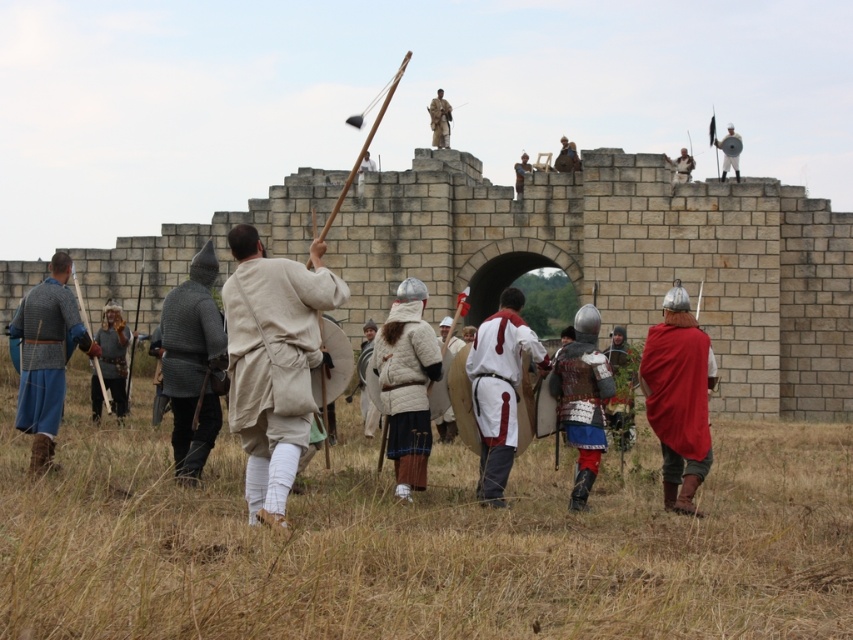
You are a historian analyzing a historical reenactment scene. You notice the metallic chainmail armor at left. Can you determine its exact coordinates in the image?

The metallic chainmail armor at left is located at coordinates point [45,356].

You are a medieval squire observing the historical reenactment. You need to determine which item is smaller between the red cloth cape at center and the metallic chainmail armor at left. Which one is smaller?

The red cloth cape at center has a smaller size compared to metallic chainmail armor at left, so the red cloth cape at center is smaller.